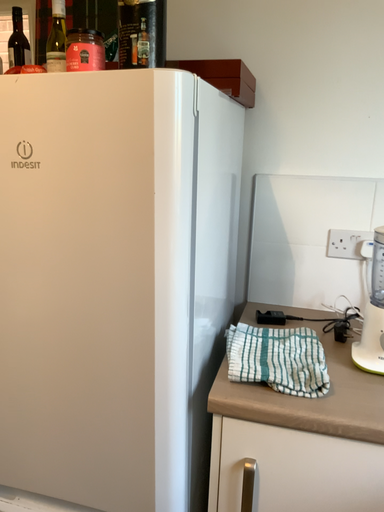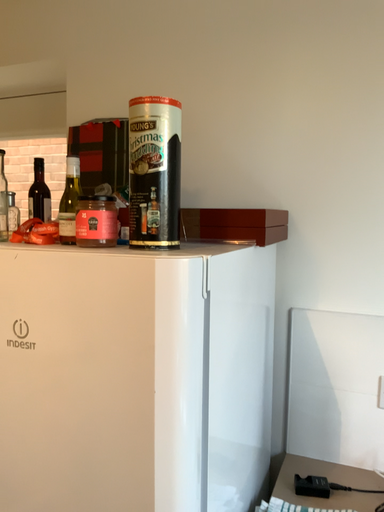
Question: How did the camera likely rotate when shooting the video?

Choices:
 (A) rotated right
 (B) rotated left

Answer: (B)